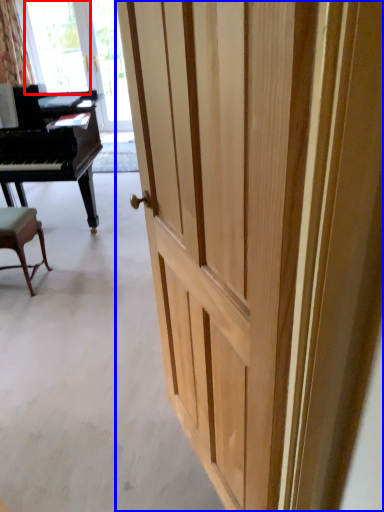
Question: Which point is further to the camera, window screen (highlighted by a red box) or door (highlighted by a blue box)?

Choices:
 (A) window screen
 (B) door

Answer: (A)